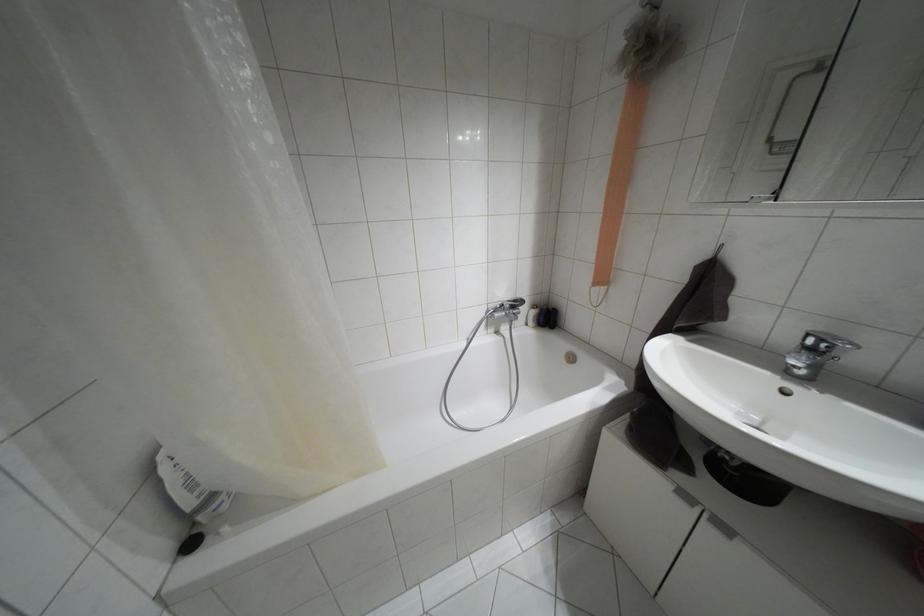
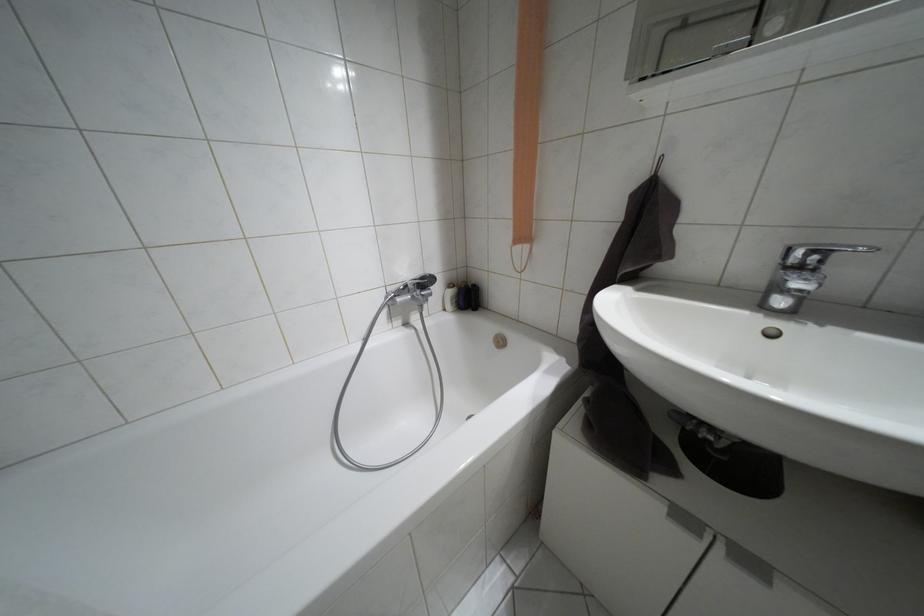
Find the pixel in the second image that matches point (821, 339) in the first image.

(810, 253)